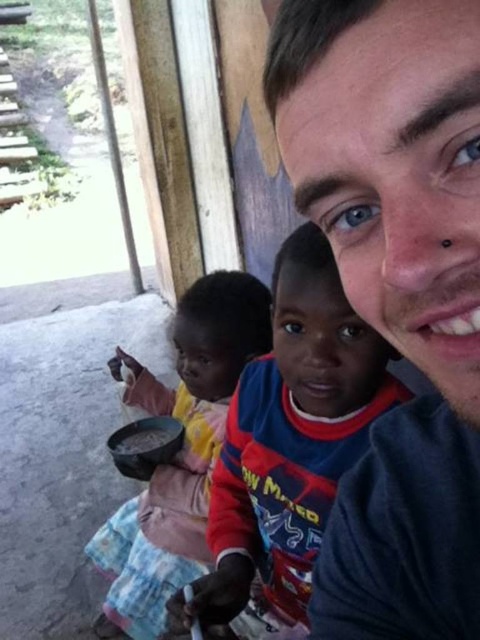
You are a photographer trying to capture a closeup of the smooth brown rice at lower left. Since the matte plastic bowl at lower left is in the way, can you move the bowl to the right to get a better shot?

The matte plastic bowl at lower left is much taller than smooth brown rice at lower left. Moving the bowl to the right might not help because the bowl is taller and could still block the view of the rice.

You are taking a selfie and want to ensure all subjects are in focus. The camera has a depth of field that can sharply focus on objects within 10 inches of the focal point. If you focus on the point at coordinates point [314,189], will the two children and the adult male be in focus?

The distance of point [314,189] from camera is 12.16 inches. Since the depth of field can only sharply focus within 10 inches of the focal point, focusing on point [314,189] would mean the subjects beyond 12.16 plus or minus 10 inches might be out of focus. However, the exact positions of the children and adult relative to this point aren